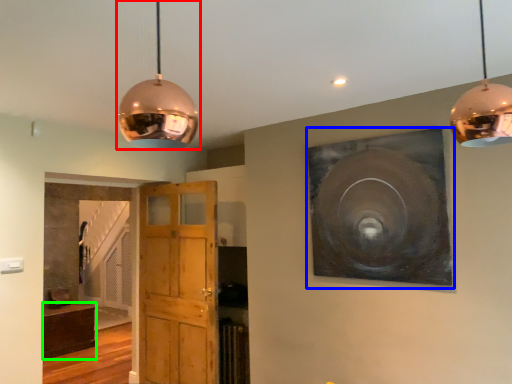
Question: Which is nearer to the lamp (highlighted by a red box)? picture frame (highlighted by a blue box) or cabinetry (highlighted by a green box).

Choices:
 (A) picture frame
 (B) cabinetry

Answer: (A)